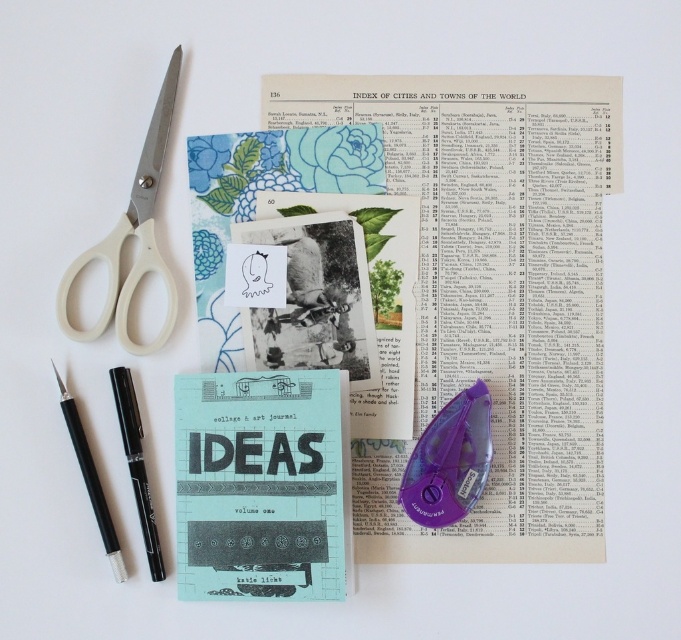
Question: Among these objects, which one is nearest to the camera?

Choices:
 (A) black plastic pen at lower left
 (B) black matte pen at lower left

Answer: (A)

Question: From the image, what is the correct spatial relationship of white plastic scissors at left in relation to purple plastic tape dispenser at center-right?

Choices:
 (A) above
 (B) below

Answer: (A)

Question: Is black matte pen at lower left below black plastic pen at lower left?

Choices:
 (A) no
 (B) yes

Answer: (A)

Question: Can you confirm if white plastic scissors at left is wider than black matte pen at lower left?

Choices:
 (A) yes
 (B) no

Answer: (A)

Question: Which of the following is the closest to the observer?

Choices:
 (A) black matte pen at lower left
 (B) matte blue paper at center
 (C) purple plastic tape dispenser at center-right

Answer: (B)

Question: Which object is positioned closest to the black plastic pen at lower left?

Choices:
 (A) purple plastic tape dispenser at center-right
 (B) matte blue paper at center

Answer: (B)